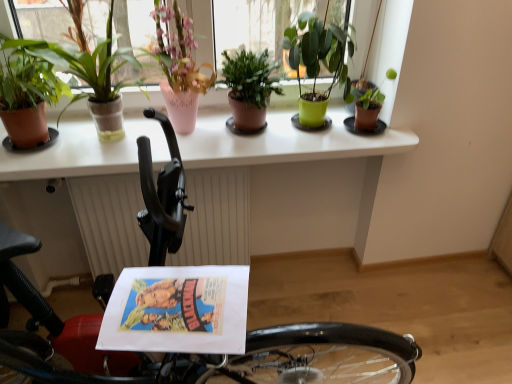
Describe the element at coordinates (324, 355) in the screenshot. I see `black rubber bicycle at lower left` at that location.

Measure the distance between point (250, 68) and camera.

Point (250, 68) is 4.98 feet away from camera.

Describe the element at coordinates (365, 109) in the screenshot. I see `green matte plant at upper right, marked as the 1th houseplant in a right-to-left arrangement` at that location.

Image resolution: width=512 pixels, height=384 pixels. I want to click on green matte plant at upper right, marked as the 1th houseplant in a right-to-left arrangement, so click(365, 109).

You are a GUI agent. You are given a task and a screenshot of the screen. Output one action in this format:
    pyautogui.click(x=<x>, y=<y>)
    Task: Click on the terracotta pot plant at left, the 5th houseplant when ordered from right to left
    This screenshot has height=384, width=512.
    Given the screenshot: What is the action you would take?
    pyautogui.click(x=91, y=70)

Image resolution: width=512 pixels, height=384 pixels. What do you see at coordinates (284, 143) in the screenshot?
I see `white glossy counter top at upper center` at bounding box center [284, 143].

What do you see at coordinates (318, 62) in the screenshot? I see `green matte plant at upper center, which is counted as the second houseplant, starting from the right` at bounding box center [318, 62].

The height and width of the screenshot is (384, 512). Find the location of `green matte plant at upper center, acting as the 5th houseplant starting from the left`. green matte plant at upper center, acting as the 5th houseplant starting from the left is located at coordinates (318, 62).

Identify the location of black rubber bicycle at lower left. The width and height of the screenshot is (512, 384). (324, 355).

The height and width of the screenshot is (384, 512). I want to click on bicycle on the right of the terracotta pot plant at left, the 5th houseplant when ordered from right to left, so click(324, 355).

Is black rubber bicycle at lower left positioned beyond the bounds of terracotta pot plant at left, the 5th houseplant when ordered from right to left?

Absolutely, black rubber bicycle at lower left is external to terracotta pot plant at left, the 5th houseplant when ordered from right to left.

Is black rubber bicycle at lower left far away from terracotta pot plant at left, which appears as the 2th houseplant when viewed from the left?

No, black rubber bicycle at lower left is in close proximity to terracotta pot plant at left, which appears as the 2th houseplant when viewed from the left.

Which of these two, black rubber bicycle at lower left or terracotta pot plant at left, the 5th houseplant when ordered from right to left, is smaller?

terracotta pot plant at left, the 5th houseplant when ordered from right to left.

From the image's perspective, which one is positioned higher, green matte plant at center, arranged as the 3th houseplant when viewed from the right, or white textured radiator at center?

From the image's view, green matte plant at center, arranged as the 3th houseplant when viewed from the right, is above.

Is green matte plant at center, the 4th houseplant positioned from the left, far away from white textured radiator at center?

green matte plant at center, the 4th houseplant positioned from the left, is actually quite close to white textured radiator at center.

How different are the orientations of green matte plant at center, arranged as the 3th houseplant when viewed from the right, and white textured radiator at center in degrees?

There is a 1.2-degree angle between the facing directions of green matte plant at center, arranged as the 3th houseplant when viewed from the right, and white textured radiator at center.

From the image's perspective, which houseplant is the 3rd one above the green matte plant at upper right, which is the sixth houseplant in left-to-right order? Please provide its 2D coordinates.

[(179, 66)]

Is pink ceramic vase at upper left, the third houseplant positioned from the left, further to camera compared to green matte plant at upper right, which is the sixth houseplant in left-to-right order?

No, it is in front of green matte plant at upper right, which is the sixth houseplant in left-to-right order.

Does pink ceramic vase at upper left, which appears as the 4th houseplant when viewed from the right, appear on the right side of green matte plant at upper right, which is the sixth houseplant in left-to-right order?

No, pink ceramic vase at upper left, which appears as the 4th houseplant when viewed from the right, is not to the right of green matte plant at upper right, which is the sixth houseplant in left-to-right order.

Considering the sizes of objects pink ceramic vase at upper left, the third houseplant positioned from the left, and green matte plant at upper right, marked as the 1th houseplant in a right-to-left arrangement, in the image provided, who is bigger, pink ceramic vase at upper left, the third houseplant positioned from the left, or green matte plant at upper right, marked as the 1th houseplant in a right-to-left arrangement,?

pink ceramic vase at upper left, the third houseplant positioned from the left.

Can you confirm if matte brown pot at left, arranged as the 6th houseplant when viewed from the right, is positioned to the left of white textured radiator at center?

Indeed, matte brown pot at left, arranged as the 6th houseplant when viewed from the right, is positioned on the left side of white textured radiator at center.

Is white textured radiator at center completely or partially inside matte brown pot at left, which is the 1th houseplant from left to right?

No.

Is matte brown pot at left, which is the 1th houseplant from left to right, far away from white textured radiator at center?

That's not correct — matte brown pot at left, which is the 1th houseplant from left to right, is a little close to white textured radiator at center.

Which is in front, point (42, 138) or point (80, 211)?

The point (42, 138) is closer to the camera.

Could you tell me if pink ceramic vase at upper left, the third houseplant positioned from the left, is turned towards black rubber bicycle at lower left?

Yes, pink ceramic vase at upper left, the third houseplant positioned from the left, faces towards black rubber bicycle at lower left.

Considering the points (200, 78) and (186, 281), which point is behind, point (200, 78) or point (186, 281)?

Point (200, 78)

From a real-world perspective, is pink ceramic vase at upper left, which appears as the 4th houseplant when viewed from the right, positioned under black rubber bicycle at lower left based on gravity?

No.

Which object is further away from the camera, pink ceramic vase at upper left, the third houseplant positioned from the left, or black rubber bicycle at lower left?

Positioned behind is pink ceramic vase at upper left, the third houseplant positioned from the left.

Is terracotta pot plant at left, the 5th houseplant when ordered from right to left, facing towards matte brown pot at left, which is the 1th houseplant from left to right?

No, terracotta pot plant at left, the 5th houseplant when ordered from right to left, is not aimed at matte brown pot at left, which is the 1th houseplant from left to right.

Consider the image. Who is bigger, terracotta pot plant at left, the 5th houseplant when ordered from right to left, or matte brown pot at left, which is the 1th houseplant from left to right?

Bigger between the two is terracotta pot plant at left, the 5th houseplant when ordered from right to left.

Can you confirm if terracotta pot plant at left, which appears as the 2th houseplant when viewed from the left, is thinner than matte brown pot at left, arranged as the 6th houseplant when viewed from the right?

Indeed, terracotta pot plant at left, which appears as the 2th houseplant when viewed from the left, has a lesser width compared to matte brown pot at left, arranged as the 6th houseplant when viewed from the right.

Considering the sizes of terracotta pot plant at left, which appears as the 2th houseplant when viewed from the left, and matte brown pot at left, which is the 1th houseplant from left to right, in the image, is terracotta pot plant at left, which appears as the 2th houseplant when viewed from the left, taller or shorter than matte brown pot at left, which is the 1th houseplant from left to right,?

Considering their sizes, terracotta pot plant at left, which appears as the 2th houseplant when viewed from the left, has more height than matte brown pot at left, which is the 1th houseplant from left to right.

Which object is further away from the camera, terracotta pot plant at left, the 5th houseplant when ordered from right to left, or white glossy counter top at upper center?

white glossy counter top at upper center is more distant.

Considering the relative sizes of terracotta pot plant at left, which appears as the 2th houseplant when viewed from the left, and white glossy counter top at upper center in the image provided, is terracotta pot plant at left, which appears as the 2th houseplant when viewed from the left, shorter than white glossy counter top at upper center?

In fact, terracotta pot plant at left, which appears as the 2th houseplant when viewed from the left, may be taller than white glossy counter top at upper center.

From a real-world perspective, does terracotta pot plant at left, the 5th houseplant when ordered from right to left, stand above white glossy counter top at upper center?

Yes, from a real-world perspective, terracotta pot plant at left, the 5th houseplant when ordered from right to left, is over white glossy counter top at upper center

Identify the location of the 2nd houseplant to the left when counting from the white glossy counter top at upper center. The height and width of the screenshot is (384, 512). (91, 70).

Identify the location of bicycle in front of the terracotta pot plant at left, the 5th houseplant when ordered from right to left. This screenshot has width=512, height=384. point(324,355).

Image resolution: width=512 pixels, height=384 pixels. In order to click on the 2nd houseplant to the right of the white textured radiator at center, counting from the anchor's position in this screenshot , I will do `click(249, 88)`.

Based on their spatial positions, is terracotta pot plant at left, which appears as the 2th houseplant when viewed from the left, or green matte plant at upper center, which is counted as the second houseplant, starting from the right, closer to white glossy counter top at upper center?

terracotta pot plant at left, which appears as the 2th houseplant when viewed from the left.

Based on their spatial positions, is black rubber bicycle at lower left or white glossy counter top at upper center further from green matte plant at upper right, which is the sixth houseplant in left-to-right order?

Based on the image, black rubber bicycle at lower left appears to be further to green matte plant at upper right, which is the sixth houseplant in left-to-right order.

When comparing their distances from pink ceramic vase at upper left, the third houseplant positioned from the left, does white glossy counter top at upper center or green matte plant at center, arranged as the 3th houseplant when viewed from the right, seem further?

white glossy counter top at upper center lies further to pink ceramic vase at upper left, the third houseplant positioned from the left, than the other object.

Based on their spatial positions, is white glossy counter top at upper center or pink ceramic vase at upper left, the third houseplant positioned from the left, closer to green matte plant at upper center, which is counted as the second houseplant, starting from the right?

Among the two, white glossy counter top at upper center is located nearer to green matte plant at upper center, which is counted as the second houseplant, starting from the right.

Considering their positions, is matte brown pot at left, arranged as the 6th houseplant when viewed from the right, positioned closer to white glossy counter top at upper center than green matte plant at upper right, marked as the 1th houseplant in a right-to-left arrangement?

The object closer to white glossy counter top at upper center is matte brown pot at left, arranged as the 6th houseplant when viewed from the right.

From the image, which object appears to be nearer to green matte plant at upper center, which is counted as the second houseplant, starting from the right, matte brown pot at left, which is the 1th houseplant from left to right, or green matte plant at center, arranged as the 3th houseplant when viewed from the right?

Among the two, green matte plant at center, arranged as the 3th houseplant when viewed from the right, is located nearer to green matte plant at upper center, which is counted as the second houseplant, starting from the right.

When comparing their distances from white textured radiator at center, does green matte plant at center, the 4th houseplant positioned from the left, or green matte plant at upper center, acting as the 5th houseplant starting from the left, seem closer?

Among the two, green matte plant at center, the 4th houseplant positioned from the left, is located nearer to white textured radiator at center.

Based on their spatial positions, is pink ceramic vase at upper left, which appears as the 4th houseplant when viewed from the right, or green matte plant at upper center, which is counted as the second houseplant, starting from the right, further from green matte plant at upper right, marked as the 1th houseplant in a right-to-left arrangement?

The object further to green matte plant at upper right, marked as the 1th houseplant in a right-to-left arrangement, is pink ceramic vase at upper left, which appears as the 4th houseplant when viewed from the right.

You are a GUI agent. You are given a task and a screenshot of the screen. Output one action in this format:
    pyautogui.click(x=<x>, y=<y>)
    Task: Click on the houseplant situated between pink ceramic vase at upper left, the third houseplant positioned from the left, and green matte plant at upper center, which is counted as the second houseplant, starting from the right, from left to right
    The image size is (512, 384).
    Given the screenshot: What is the action you would take?
    pyautogui.click(x=249, y=88)

You are a GUI agent. You are given a task and a screenshot of the screen. Output one action in this format:
    pyautogui.click(x=<x>, y=<y>)
    Task: Click on the houseplant located between terracotta pot plant at left, the 5th houseplant when ordered from right to left, and white glossy counter top at upper center in the left-right direction
    
    Given the screenshot: What is the action you would take?
    pyautogui.click(x=179, y=66)

Where is `counter top between terracotta pot plant at left, which appears as the 2th houseplant when viewed from the left, and green matte plant at upper center, acting as the 5th houseplant starting from the left`? The width and height of the screenshot is (512, 384). counter top between terracotta pot plant at left, which appears as the 2th houseplant when viewed from the left, and green matte plant at upper center, acting as the 5th houseplant starting from the left is located at coordinates (284, 143).

The image size is (512, 384). Find the location of `bicycle between matte brown pot at left, arranged as the 6th houseplant when viewed from the right, and green matte plant at upper right, which is the sixth houseplant in left-to-right order, in the horizontal direction`. bicycle between matte brown pot at left, arranged as the 6th houseplant when viewed from the right, and green matte plant at upper right, which is the sixth houseplant in left-to-right order, in the horizontal direction is located at coordinates (324, 355).